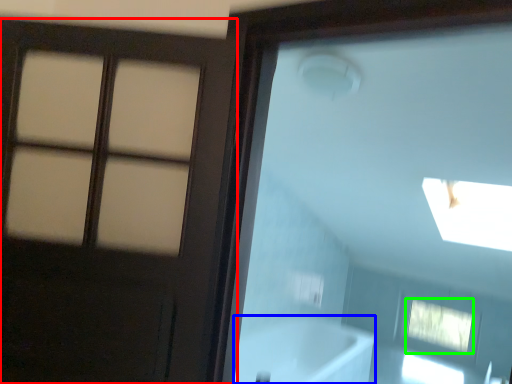
Question: Considering the real-world distances, which object is closest to door (highlighted by a red box)? bath (highlighted by a blue box) or window (highlighted by a green box).

Choices:
 (A) bath
 (B) window

Answer: (A)